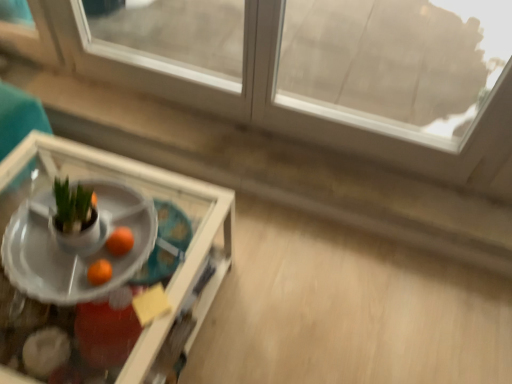
I want to click on vacant area on the back side of orange matte at center, so click(x=129, y=211).